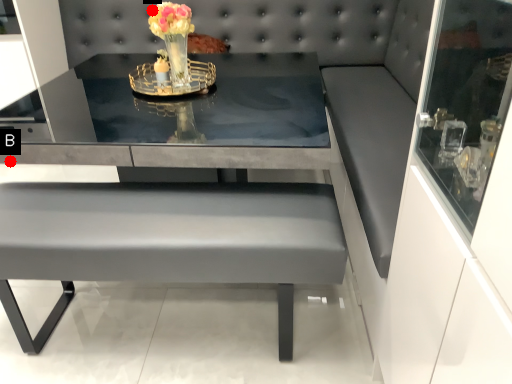
Question: Two points are circled on the image, labeled by A and B beside each circle. Which point is closer to the camera?

Choices:
 (A) A is closer
 (B) B is closer

Answer: (B)